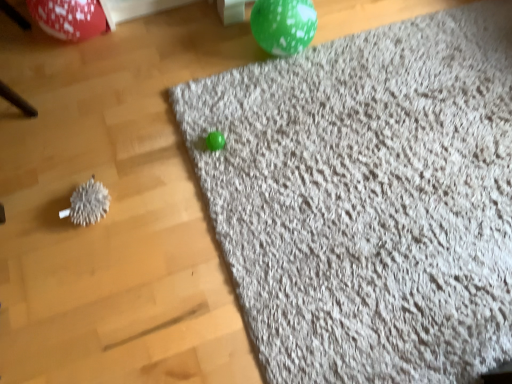
This screenshot has height=384, width=512. Describe the element at coordinates (283, 25) in the screenshot. I see `green speckled balloon at upper center, which appears as the second balloon when viewed from the left` at that location.

This screenshot has width=512, height=384. What do you see at coordinates (368, 199) in the screenshot? I see `gray shaggy rug at upper right` at bounding box center [368, 199].

The width and height of the screenshot is (512, 384). Describe the element at coordinates (69, 18) in the screenshot. I see `shiny red balloon at upper left, which is counted as the first balloon, starting from the left` at that location.

This screenshot has height=384, width=512. What do you see at coordinates (88, 203) in the screenshot?
I see `white fuzzy ball at left` at bounding box center [88, 203].

Locate an element on the screen. Image resolution: width=512 pixels, height=384 pixels. green speckled balloon at upper center, marked as the first balloon in a right-to-left arrangement is located at coordinates (283, 25).

Can you see green speckled balloon at upper center, which appears as the second balloon when viewed from the left, touching white fuzzy ball at left?

No, green speckled balloon at upper center, which appears as the second balloon when viewed from the left, is not next to white fuzzy ball at left.

Measure the distance from green speckled balloon at upper center, marked as the first balloon in a right-to-left arrangement, to white fuzzy ball at left.

They are 30.71 inches apart.

Does green speckled balloon at upper center, marked as the first balloon in a right-to-left arrangement, have a lesser width compared to white fuzzy ball at left?

No.

Is green speckled balloon at upper center, marked as the first balloon in a right-to-left arrangement, further to the viewer compared to white fuzzy ball at left?

Yes, it is behind white fuzzy ball at left.

Is gray shaggy rug at upper right a part of white fuzzy ball at left?

That's incorrect, gray shaggy rug at upper right is not inside white fuzzy ball at left.

Would you say white fuzzy ball at left is to the left or to the right of gray shaggy rug at upper right in the picture?

From the image, it's evident that white fuzzy ball at left is to the left of gray shaggy rug at upper right.

From the picture: Which of these two, white fuzzy ball at left or gray shaggy rug at upper right, stands shorter?

With less height is gray shaggy rug at upper right.

How many degrees apart are the facing directions of green speckled balloon at upper center, marked as the first balloon in a right-to-left arrangement, and shiny red balloon at upper left, which is counted as the first balloon, starting from the left?

1.74 degrees separate the facing orientations of green speckled balloon at upper center, marked as the first balloon in a right-to-left arrangement, and shiny red balloon at upper left, which is counted as the first balloon, starting from the left.

Can you see green speckled balloon at upper center, marked as the first balloon in a right-to-left arrangement, touching shiny red balloon at upper left, marked as the second balloon in a right-to-left arrangement?

green speckled balloon at upper center, marked as the first balloon in a right-to-left arrangement, is not next to shiny red balloon at upper left, marked as the second balloon in a right-to-left arrangement, and they're not touching.

Can you confirm if green speckled balloon at upper center, which appears as the second balloon when viewed from the left, is shorter than shiny red balloon at upper left, marked as the second balloon in a right-to-left arrangement?

Yes.

This screenshot has width=512, height=384. I want to click on balloon below the shiny red balloon at upper left, which is counted as the first balloon, starting from the left (from the image's perspective), so click(283, 25).

Does gray shaggy rug at upper right have a lesser width compared to green speckled balloon at upper center, which appears as the second balloon when viewed from the left?

Incorrect, the width of gray shaggy rug at upper right is not less than that of green speckled balloon at upper center, which appears as the second balloon when viewed from the left.

Does gray shaggy rug at upper right have a smaller size compared to green speckled balloon at upper center, which appears as the second balloon when viewed from the left?

No.

Is gray shaggy rug at upper right taller or shorter than green speckled balloon at upper center, which appears as the second balloon when viewed from the left?

gray shaggy rug at upper right is shorter than green speckled balloon at upper center, which appears as the second balloon when viewed from the left.

Locate an element on the screen. The height and width of the screenshot is (384, 512). the 1st balloon above the gray shaggy rug at upper right (from the image's perspective) is located at coordinates (283, 25).

Is white fuzzy ball at left aimed at green speckled balloon at upper center, which appears as the second balloon when viewed from the left?

No, white fuzzy ball at left does not turn towards green speckled balloon at upper center, which appears as the second balloon when viewed from the left.

Based on the photo, considering the sizes of objects white fuzzy ball at left and green speckled balloon at upper center, marked as the first balloon in a right-to-left arrangement, in the image provided, who is thinner, white fuzzy ball at left or green speckled balloon at upper center, marked as the first balloon in a right-to-left arrangement,?

white fuzzy ball at left is thinner.

Does white fuzzy ball at left touch green speckled balloon at upper center, which appears as the second balloon when viewed from the left?

No, white fuzzy ball at left is not with green speckled balloon at upper center, which appears as the second balloon when viewed from the left.

Considering their positions, is white fuzzy ball at left located in front of or behind shiny red balloon at upper left, which is counted as the first balloon, starting from the left?

white fuzzy ball at left is in front of shiny red balloon at upper left, which is counted as the first balloon, starting from the left.

Is white fuzzy ball at left at the left side of shiny red balloon at upper left, marked as the second balloon in a right-to-left arrangement?

In fact, white fuzzy ball at left is to the right of shiny red balloon at upper left, marked as the second balloon in a right-to-left arrangement.

Is white fuzzy ball at left looking in the opposite direction of shiny red balloon at upper left, marked as the second balloon in a right-to-left arrangement?

Correct, white fuzzy ball at left is looking away from shiny red balloon at upper left, marked as the second balloon in a right-to-left arrangement.

Would you say white fuzzy ball at left is outside shiny red balloon at upper left, which is counted as the first balloon, starting from the left?

Absolutely, white fuzzy ball at left is external to shiny red balloon at upper left, which is counted as the first balloon, starting from the left.

Could you tell me if gray shaggy rug at upper right is turned towards shiny red balloon at upper left, marked as the second balloon in a right-to-left arrangement?

No, gray shaggy rug at upper right is not facing towards shiny red balloon at upper left, marked as the second balloon in a right-to-left arrangement.

Between point (216, 196) and point (57, 7), which one is positioned in front?

Positioned in front is point (216, 196).

In the scene shown: From the image's perspective, is gray shaggy rug at upper right on top of shiny red balloon at upper left, marked as the second balloon in a right-to-left arrangement?

No, from the image's perspective, gray shaggy rug at upper right is not on top of shiny red balloon at upper left, marked as the second balloon in a right-to-left arrangement.

Based on their positions, is gray shaggy rug at upper right located to the left or right of shiny red balloon at upper left, which is counted as the first balloon, starting from the left?

gray shaggy rug at upper right is positioned on shiny red balloon at upper left, which is counted as the first balloon, starting from the left,'s right side.

Identify the location of the 1st balloon positioned above the white fuzzy ball at left (from the image's perspective). This screenshot has height=384, width=512. (283, 25).

At what (x,y) coordinates should I click in order to perform the action: click on toy below the gray shaggy rug at upper right (from the image's perspective). Please return your answer as a coordinate pair (x, y). The height and width of the screenshot is (384, 512). Looking at the image, I should click on (88, 203).

From the image, which object appears to be nearer to white fuzzy ball at left, gray shaggy rug at upper right or green speckled balloon at upper center, which appears as the second balloon when viewed from the left?

gray shaggy rug at upper right.

Considering their positions, is white fuzzy ball at left positioned closer to shiny red balloon at upper left, marked as the second balloon in a right-to-left arrangement, than gray shaggy rug at upper right?

white fuzzy ball at left is closer to shiny red balloon at upper left, marked as the second balloon in a right-to-left arrangement.

Looking at the image, which one is located further to green speckled balloon at upper center, marked as the first balloon in a right-to-left arrangement, white fuzzy ball at left or gray shaggy rug at upper right?

The object further to green speckled balloon at upper center, marked as the first balloon in a right-to-left arrangement, is white fuzzy ball at left.

When comparing their distances from white fuzzy ball at left, does green speckled balloon at upper center, which appears as the second balloon when viewed from the left, or gray shaggy rug at upper right seem further?

green speckled balloon at upper center, which appears as the second balloon when viewed from the left, is further to white fuzzy ball at left.

When comparing their distances from gray shaggy rug at upper right, does green speckled balloon at upper center, marked as the first balloon in a right-to-left arrangement, or shiny red balloon at upper left, which is counted as the first balloon, starting from the left, seem further?

Among the two, shiny red balloon at upper left, which is counted as the first balloon, starting from the left, is located further to gray shaggy rug at upper right.

Considering their positions, is shiny red balloon at upper left, which is counted as the first balloon, starting from the left, positioned closer to white fuzzy ball at left than green speckled balloon at upper center, which appears as the second balloon when viewed from the left?

shiny red balloon at upper left, which is counted as the first balloon, starting from the left, is closer to white fuzzy ball at left.

Looking at the image, which one is located closer to gray shaggy rug at upper right, green speckled balloon at upper center, which appears as the second balloon when viewed from the left, or white fuzzy ball at left?

green speckled balloon at upper center, which appears as the second balloon when viewed from the left, is positioned closer to the anchor gray shaggy rug at upper right.

When comparing their distances from green speckled balloon at upper center, marked as the first balloon in a right-to-left arrangement, does shiny red balloon at upper left, which is counted as the first balloon, starting from the left, or gray shaggy rug at upper right seem closer?

Based on the image, gray shaggy rug at upper right appears to be nearer to green speckled balloon at upper center, marked as the first balloon in a right-to-left arrangement.

Where is `toy located between shiny red balloon at upper left, marked as the second balloon in a right-to-left arrangement, and green speckled balloon at upper center, marked as the first balloon in a right-to-left arrangement, in the left-right direction`? The height and width of the screenshot is (384, 512). toy located between shiny red balloon at upper left, marked as the second balloon in a right-to-left arrangement, and green speckled balloon at upper center, marked as the first balloon in a right-to-left arrangement, in the left-right direction is located at coordinates (88, 203).

The image size is (512, 384). In order to click on balloon between white fuzzy ball at left and gray shaggy rug at upper right in the horizontal direction in this screenshot , I will do `click(283, 25)`.

I want to click on balloon between shiny red balloon at upper left, marked as the second balloon in a right-to-left arrangement, and gray shaggy rug at upper right, so click(283, 25).

The image size is (512, 384). I want to click on toy between shiny red balloon at upper left, which is counted as the first balloon, starting from the left, and gray shaggy rug at upper right from left to right, so click(88, 203).